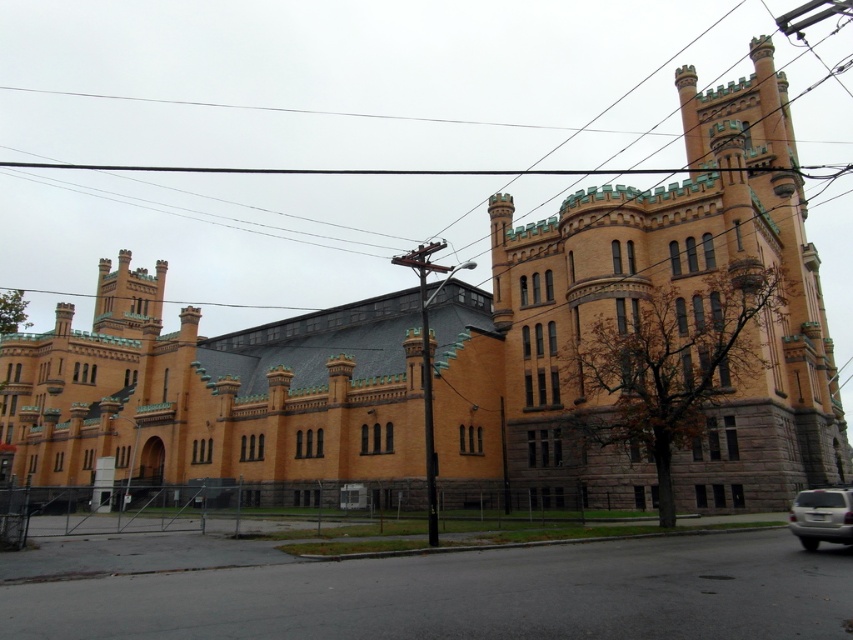
Does point (45, 156) come in front of point (801, 525)?

No.

Can you confirm if black wire at upper center is positioned above silver metallic suv at lower right?

Yes, black wire at upper center is above silver metallic suv at lower right.

Is point (18, 132) closer to camera compared to point (808, 544)?

No.

I want to click on black wire at upper center, so click(x=392, y=81).